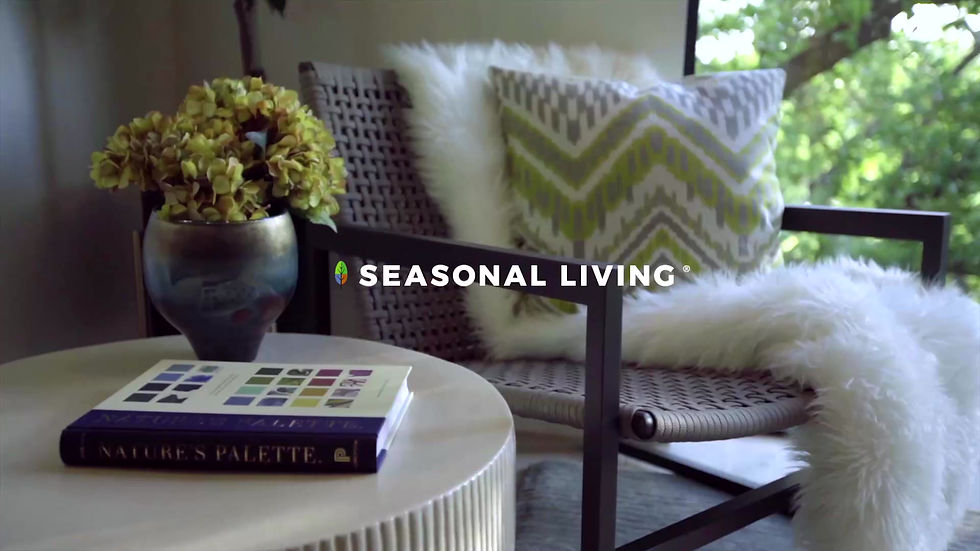
Locate an element on the screen. chair is located at coordinates (378, 133).